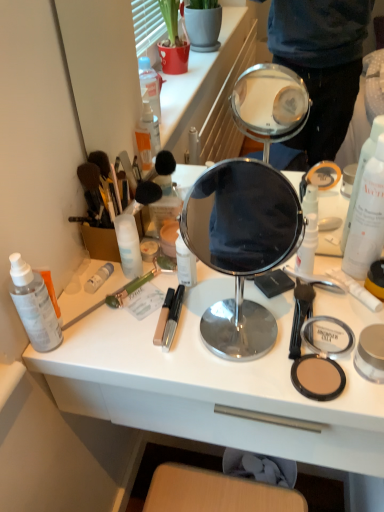
Where is `free space to the left of matte black compact at lower right`? free space to the left of matte black compact at lower right is located at coordinates (215, 361).